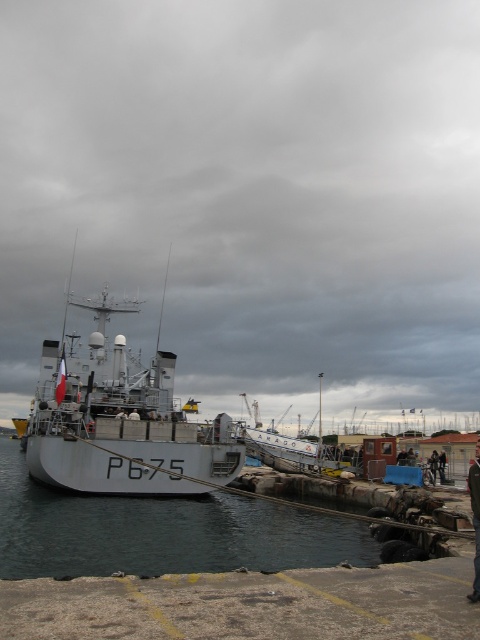
You are a crew member needing to board the metallic gray ship at center from the pier. There is a dark blue uniform at center on the pier. Can you wear the uniform before boarding?

The metallic gray ship at center might be wider than dark blue uniform at center, but the question of wearing the uniform is unrelated to their sizes. You can wear the dark blue uniform at center before boarding the ship as it is on the pier.

You are a crew member on the pier and need to board the metallic gray ship at center. Considering the height difference between the ship and your dark blue uniform at center, will you need a ladder or can you step onto the ship directly?

The metallic gray ship at center is taller than the dark blue uniform at center, so you will need a ladder or some form of assistance to board the ship directly.